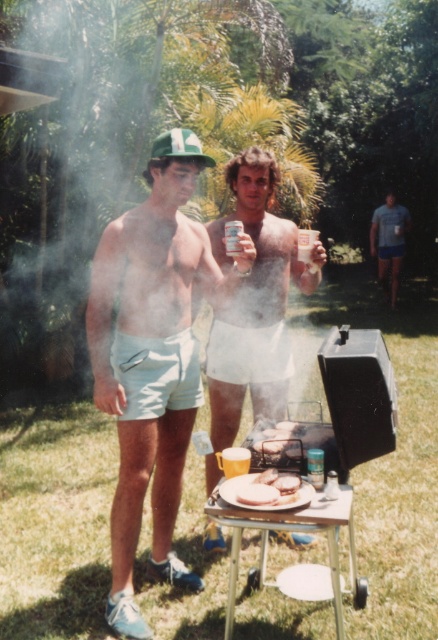
Question: Can you confirm if white matte shorts at center is bigger than white matte sandwich at center?

Choices:
 (A) no
 (B) yes

Answer: (B)

Question: Based on their relative distances, which object is nearer to the white matte sandwich at center?

Choices:
 (A) white matte shorts at center
 (B) light blue cotton shorts at left
 (C) smooth white bread at center
 (D) blue cotton shirt at right

Answer: (C)

Question: Is blue cotton shirt at right closer to camera compared to white matte sandwich at center?

Choices:
 (A) yes
 (B) no

Answer: (B)

Question: Which object appears farthest from the camera in this image?

Choices:
 (A) blue cotton shirt at right
 (B) smooth white bread at center

Answer: (A)

Question: Does light blue cotton shorts at left have a larger size compared to white matte sandwich at center?

Choices:
 (A) no
 (B) yes

Answer: (B)

Question: Which point is farther to the camera?

Choices:
 (A) (251, 490)
 (B) (215, 474)
 (C) (155, 326)

Answer: (B)